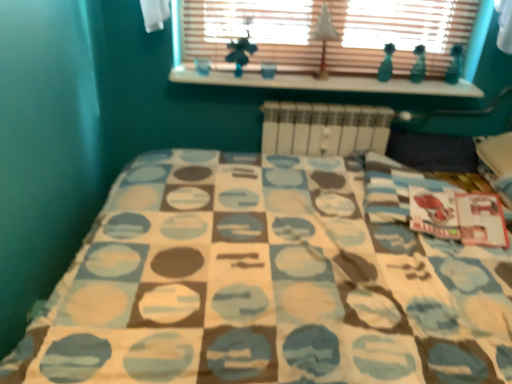
In order to click on white painted wood at upper center in this screenshot , I will do `click(329, 83)`.

Image resolution: width=512 pixels, height=384 pixels. Describe the element at coordinates (324, 37) in the screenshot. I see `white paper tree at upper center` at that location.

What is the approximate width of white paper tree at upper center?

The width of white paper tree at upper center is 2.74 inches.

Identify the location of white matte radiator at center. The width and height of the screenshot is (512, 384). (324, 128).

Is white paper tree at upper center at the right side of white matte radiator at center?

No, white paper tree at upper center is not to the right of white matte radiator at center.

Between white paper tree at upper center and white matte radiator at center, which one has less height?

white paper tree at upper center is shorter.

This screenshot has height=384, width=512. What are the coordinates of `lamp in front of the white matte radiator at center` in the screenshot? It's located at (324, 37).

Is white paper tree at upper center oriented towards white matte radiator at center?

No, white paper tree at upper center is not turned towards white matte radiator at center.

Does wooden blinds at upper center lie behind white painted wood at upper center?

No, wooden blinds at upper center is closer to the camera.

Locate an element on the screen. The width and height of the screenshot is (512, 384). window above the white painted wood at upper center (from a real-world perspective) is located at coordinates (328, 41).

Is wooden blinds at upper center aimed at white painted wood at upper center?

Yes, wooden blinds at upper center is facing white painted wood at upper center.

Who is shorter, wooden blinds at upper center or white painted wood at upper center?

white painted wood at upper center.

Is white matte radiator at center positioned far away from wooden blinds at upper center?

No.

From their relative heights in the image, would you say white matte radiator at center is taller or shorter than wooden blinds at upper center?

white matte radiator at center is taller than wooden blinds at upper center.

Is white matte radiator at center completely or partially outside of wooden blinds at upper center?

Yes, white matte radiator at center is outside of wooden blinds at upper center.

From the image's perspective, which one is positioned lower, white matte radiator at center or wooden blinds at upper center?

white matte radiator at center.

Are white paper tree at upper center and white painted wood at upper center making contact?

white paper tree at upper center is not next to white painted wood at upper center, and they're not touching.

Considering the relative sizes of white paper tree at upper center and white painted wood at upper center in the image provided, is white paper tree at upper center shorter than white painted wood at upper center?

No.

Which object is further away from the camera taking this photo, white paper tree at upper center or white painted wood at upper center?

white painted wood at upper center.

Considering the sizes of objects white paper tree at upper center and white painted wood at upper center in the image provided, who is wider, white paper tree at upper center or white painted wood at upper center?

Wider between the two is white painted wood at upper center.

Looking at this image, is white matte radiator at center positioned with its back to white painted wood at upper center?

white matte radiator at center is not turned away from white painted wood at upper center.

Is white matte radiator at center inside or outside of white painted wood at upper center?

white matte radiator at center lies outside white painted wood at upper center.

How many degrees apart are the facing directions of white matte radiator at center and white painted wood at upper center?

There is a 0.717-degree angle between the facing directions of white matte radiator at center and white painted wood at upper center.

How far apart are white painted wood at upper center and white paper tree at upper center?

They are 11.82 inches apart.

Would you say white painted wood at upper center is inside or outside white paper tree at upper center?

white painted wood at upper center lies outside white paper tree at upper center.

In the scene shown: Is white painted wood at upper center next to white paper tree at upper center?

white painted wood at upper center is not next to white paper tree at upper center, and they're not touching.

Is white painted wood at upper center smaller than white paper tree at upper center?

No.

Between white painted wood at upper center and wooden blinds at upper center, which one has larger width?

white painted wood at upper center.

Considering the positions of objects white painted wood at upper center and wooden blinds at upper center in the image provided, who is in front, white painted wood at upper center or wooden blinds at upper center?

wooden blinds at upper center.

In terms of size, does white painted wood at upper center appear bigger or smaller than wooden blinds at upper center?

In the image, white painted wood at upper center appears to be smaller than wooden blinds at upper center.

In the image, there is a white matte radiator at center. At what (x,y) coordinates should I click in order to perform the action: click on lamp above it (from the image's perspective). Please return your answer as a coordinate pair (x, y). The width and height of the screenshot is (512, 384). Looking at the image, I should click on (324, 37).

Find the location of `window sill behind the wooden blinds at upper center`. window sill behind the wooden blinds at upper center is located at coordinates (329, 83).

When comparing their distances from wooden blinds at upper center, does white matte radiator at center or white paper tree at upper center seem further?

white matte radiator at center lies further to wooden blinds at upper center than the other object.

Considering their positions, is white painted wood at upper center positioned closer to white paper tree at upper center than white matte radiator at center?

white painted wood at upper center lies closer to white paper tree at upper center than the other object.

When comparing their distances from white matte radiator at center, does white paper tree at upper center or wooden blinds at upper center seem further?

wooden blinds at upper center is positioned further to the anchor white matte radiator at center.

From the picture: Based on their spatial positions, is wooden blinds at upper center or white matte radiator at center closer to white paper tree at upper center?

wooden blinds at upper center lies closer to white paper tree at upper center than the other object.

Based on their spatial positions, is white paper tree at upper center or wooden blinds at upper center closer to white painted wood at upper center?

Among the two, wooden blinds at upper center is located nearer to white painted wood at upper center.

Estimate the real-world distances between objects in this image. Which object is further from white paper tree at upper center, wooden blinds at upper center or white painted wood at upper center?

white painted wood at upper center is positioned further to the anchor white paper tree at upper center.

In the scene shown: Considering their positions, is white matte radiator at center positioned closer to white paper tree at upper center than wooden blinds at upper center?

Based on the image, wooden blinds at upper center appears to be nearer to white paper tree at upper center.

Based on their spatial positions, is white painted wood at upper center or wooden blinds at upper center closer to white paper tree at upper center?

Among the two, wooden blinds at upper center is located nearer to white paper tree at upper center.

Where is `window sill between white paper tree at upper center and white matte radiator at center from top to bottom`? This screenshot has height=384, width=512. window sill between white paper tree at upper center and white matte radiator at center from top to bottom is located at coordinates (329, 83).

The image size is (512, 384). In order to click on window sill between wooden blinds at upper center and white matte radiator at center in the vertical direction in this screenshot , I will do `click(329, 83)`.

Identify the location of lamp between wooden blinds at upper center and white painted wood at upper center from top to bottom. (324, 37).

This screenshot has height=384, width=512. Find the location of `lamp that lies between wooden blinds at upper center and white matte radiator at center from top to bottom`. lamp that lies between wooden blinds at upper center and white matte radiator at center from top to bottom is located at coordinates (324, 37).